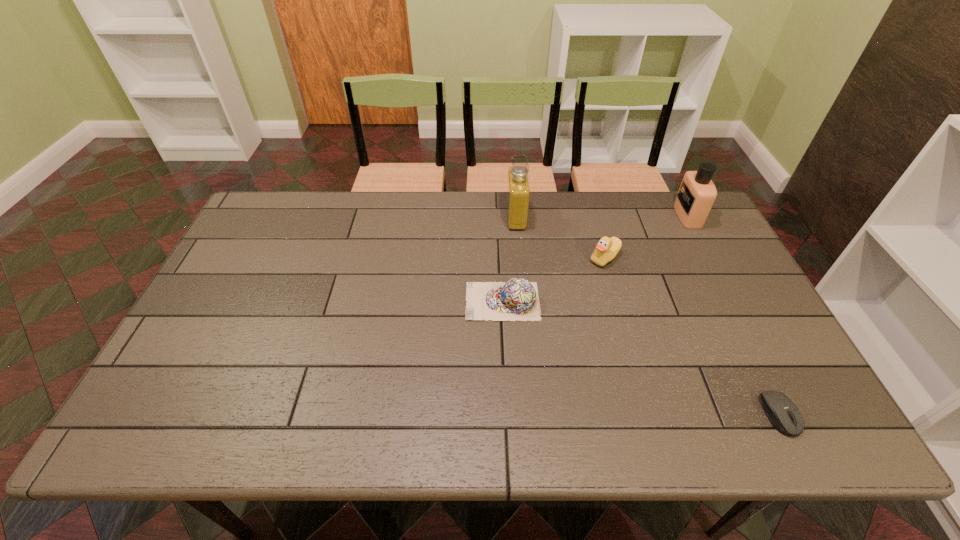
You are a GUI agent. You are given a task and a screenshot of the screen. Output one action in this format:
    pyautogui.click(x=<x>, y=<y>)
    Task: Click on the object that is the fourth nearest to the third shortest object
    Image resolution: width=960 pixels, height=540 pixels.
    Given the screenshot: What is the action you would take?
    pyautogui.click(x=781, y=411)

Identify the location of free region that satisfies the following two spatial constraints: 1. at the beak of the duck; 2. on the right side of the shortest object. The height and width of the screenshot is (540, 960). (649, 414).

At what (x,y) coordinates should I click in order to perform the action: click on free spot that satisfies the following two spatial constraints: 1. on the front, side, and top of the nearest object; 2. on the right side of the cap. Please return your answer as a coordinate pair (x, y). Looking at the image, I should click on click(508, 414).

The image size is (960, 540). I want to click on vacant space that satisfies the following two spatial constraints: 1. on the front, side, and top of the fourth tallest object; 2. on the right side of the computer equipment, so click(x=508, y=414).

Where is `vacant space that satisfies the following two spatial constraints: 1. on the front-facing side of the shortest object; 2. on the right side of the left perfume`? vacant space that satisfies the following two spatial constraints: 1. on the front-facing side of the shortest object; 2. on the right side of the left perfume is located at coordinates (534, 414).